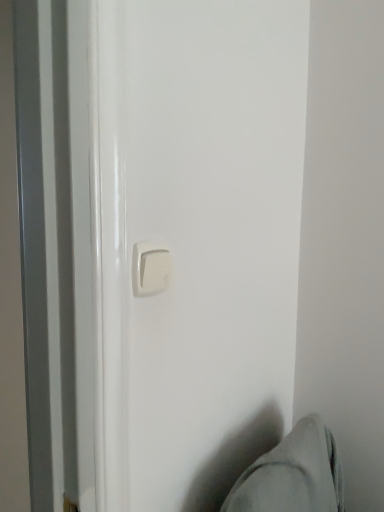
Question: Considering their positions, is white plastic door handle at center located in front of or behind gray fabric swivel chair at lower right?

Choices:
 (A) behind
 (B) front

Answer: (A)

Question: Looking at their shapes, would you say white plastic door handle at center is wider or thinner than gray fabric swivel chair at lower right?

Choices:
 (A) wide
 (B) thin

Answer: (B)

Question: From a real-world perspective, is white plastic door handle at center positioned above or below gray fabric swivel chair at lower right?

Choices:
 (A) below
 (B) above

Answer: (B)

Question: Choose the correct answer: Is gray fabric swivel chair at lower right inside white plastic door handle at center or outside it?

Choices:
 (A) outside
 (B) inside

Answer: (A)

Question: Visually, is gray fabric swivel chair at lower right positioned to the left or to the right of white plastic door handle at center?

Choices:
 (A) right
 (B) left

Answer: (A)

Question: In terms of width, does gray fabric swivel chair at lower right look wider or thinner when compared to white plastic door handle at center?

Choices:
 (A) wide
 (B) thin

Answer: (A)

Question: From the image's perspective, is gray fabric swivel chair at lower right above or below white plastic door handle at center?

Choices:
 (A) below
 (B) above

Answer: (A)